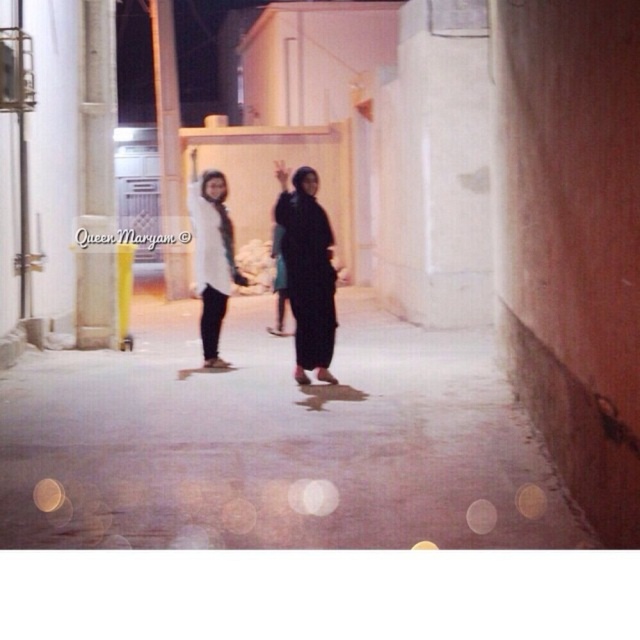
Can you confirm if black matte hijab at center is bigger than white matte shirt at center?

Incorrect, black matte hijab at center is not larger than white matte shirt at center.

The width and height of the screenshot is (640, 640). Describe the element at coordinates (307, 272) in the screenshot. I see `black matte hijab at center` at that location.

Does point (292, 257) come in front of point (214, 189)?

Yes, point (292, 257) is closer to viewer.

I want to click on black matte hijab at center, so click(x=307, y=272).

Between smooth concrete pavement at center and black matte hijab at center, which one has less height?

With less height is smooth concrete pavement at center.

Who is positioned more to the right, smooth concrete pavement at center or black matte hijab at center?

black matte hijab at center is more to the right.

What do you see at coordinates (275, 444) in the screenshot? I see `smooth concrete pavement at center` at bounding box center [275, 444].

Identify the location of smooth concrete pavement at center. Image resolution: width=640 pixels, height=640 pixels. (275, 444).

Is matte black dress at center wider than black matte hijab at center?

No, matte black dress at center is not wider than black matte hijab at center.

Can you confirm if matte black dress at center is shorter than black matte hijab at center?

Correct, matte black dress at center is not as tall as black matte hijab at center.

This screenshot has width=640, height=640. Describe the element at coordinates (307, 269) in the screenshot. I see `matte black dress at center` at that location.

The width and height of the screenshot is (640, 640). Identify the location of matte black dress at center. (307, 269).